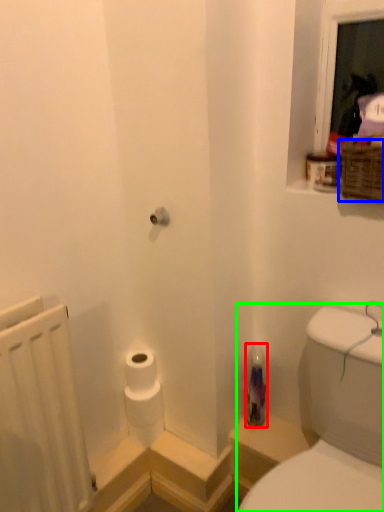
Question: Which is farther away from bottle (highlighted by a red box)? basket (highlighted by a blue box) or sink (highlighted by a green box)?

Choices:
 (A) basket
 (B) sink

Answer: (A)